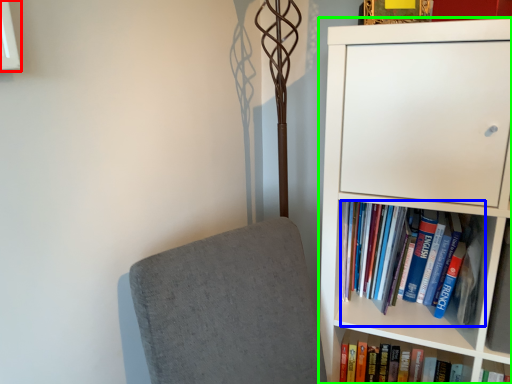
Question: Estimate the real-world distances between objects in this image. Which object is closer to window (highlighted by a red box), book (highlighted by a blue box) or bookcase (highlighted by a green box)?

Choices:
 (A) book
 (B) bookcase

Answer: (B)